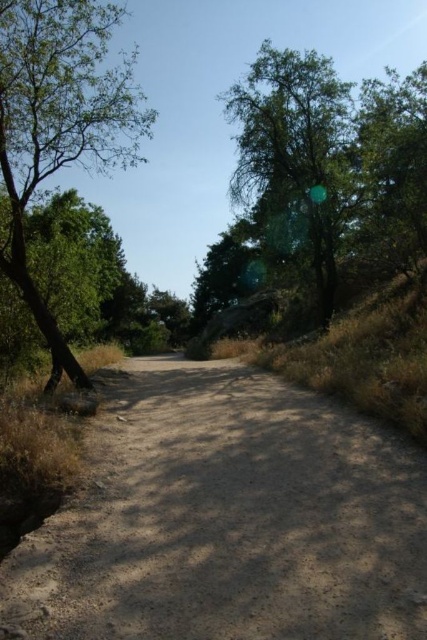
Which is in front, point (99, 518) or point (383, 198)?

Point (99, 518)

Between dusty brown dirt track at center and green leafy tree at upper right, which one has more height?

With more height is green leafy tree at upper right.

Between point (163, 580) and point (306, 108), which one is positioned behind?

Point (306, 108)

The image size is (427, 640). I want to click on dusty brown dirt track at center, so click(227, 518).

Who is shorter, green leafy tree at upper right or green leafy tree at left?

Standing shorter between the two is green leafy tree at upper right.

Does green leafy tree at upper right have a smaller size compared to green leafy tree at left?

Indeed, green leafy tree at upper right has a smaller size compared to green leafy tree at left.

This screenshot has height=640, width=427. Describe the element at coordinates (330, 163) in the screenshot. I see `green leafy tree at upper right` at that location.

This screenshot has height=640, width=427. Identify the location of green leafy tree at upper right. (330, 163).

Does dusty brown dirt track at center appear under green leafy tree at left?

Yes.

Between point (298, 611) and point (101, 24), which one is positioned in front?

Point (298, 611) is in front.

Image resolution: width=427 pixels, height=640 pixels. What are the coordinates of `dusty brown dirt track at center` in the screenshot? It's located at (227, 518).